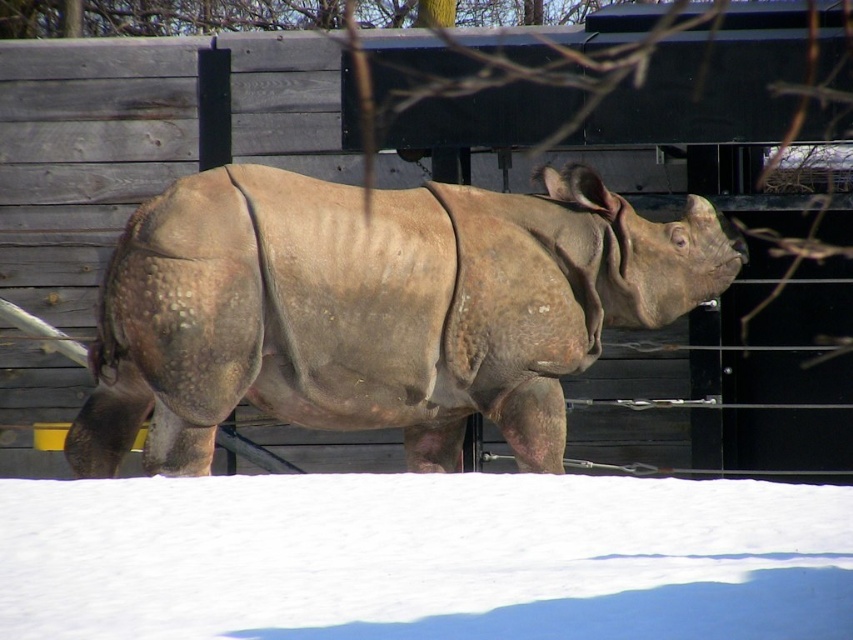
Does gray textured rhino at center have a smaller size compared to white powder snow at lower center?

No, gray textured rhino at center is not smaller than white powder snow at lower center.

Looking at this image, can you confirm if gray textured rhino at center is bigger than white powder snow at lower center?

Indeed, gray textured rhino at center has a larger size compared to white powder snow at lower center.

Describe the element at coordinates (375, 308) in the screenshot. Image resolution: width=853 pixels, height=640 pixels. I see `gray textured rhino at center` at that location.

Locate an element on the screen. gray textured rhino at center is located at coordinates (375, 308).